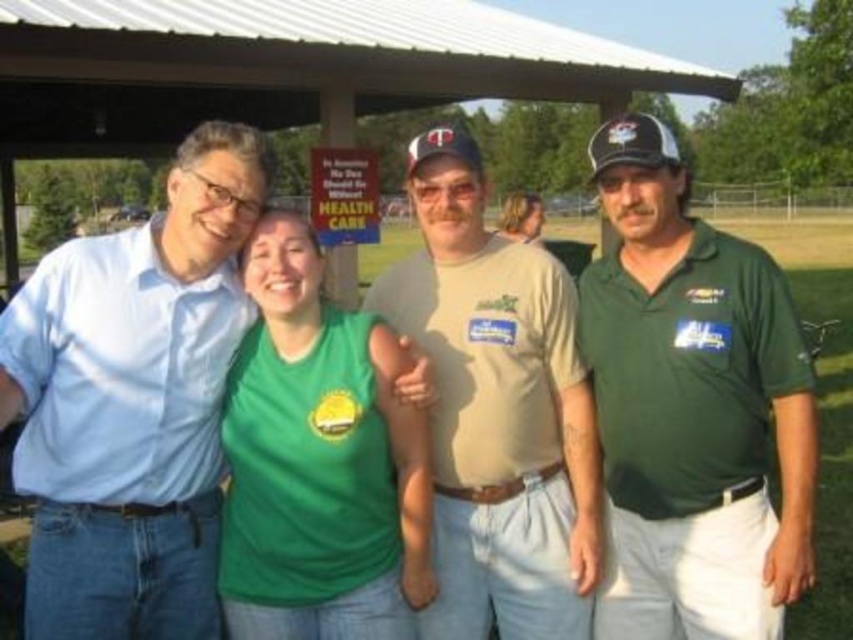
Does matte blue shirt at center appear on the left side of green cotton polo shirt at right?

Indeed, matte blue shirt at center is positioned on the left side of green cotton polo shirt at right.

Is matte blue shirt at center behind green cotton polo shirt at right?

That is False.

Based on the photo, measure the distance between point (x=38, y=387) and camera.

2.94 meters

Find the location of `matte blue shirt at center`. matte blue shirt at center is located at coordinates (132, 403).

Can you confirm if green cotton polo shirt at right is positioned to the right of green grass at center?

In fact, green cotton polo shirt at right is to the left of green grass at center.

Who is positioned more to the left, green cotton polo shirt at right or green grass at center?

green cotton polo shirt at right is more to the left.

The width and height of the screenshot is (853, 640). What are the coordinates of `green cotton polo shirt at right` in the screenshot? It's located at (692, 408).

Can you confirm if tan cotton t-shirt at center is positioned to the left of green grass at center?

Correct, you'll find tan cotton t-shirt at center to the left of green grass at center.

Does tan cotton t-shirt at center have a greater height compared to green grass at center?

No, tan cotton t-shirt at center is not taller than green grass at center.

This screenshot has height=640, width=853. What are the coordinates of `tan cotton t-shirt at center` in the screenshot? It's located at (496, 410).

Locate an element on the screen. This screenshot has height=640, width=853. tan cotton t-shirt at center is located at coordinates (496, 410).